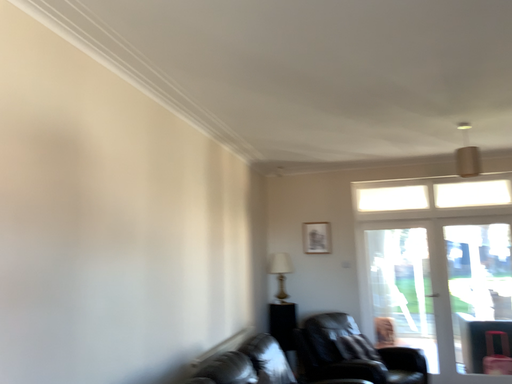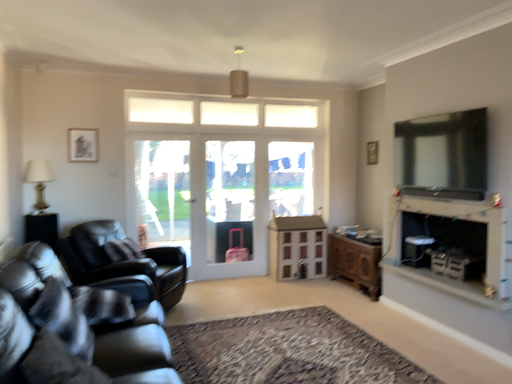
Question: How did the camera likely rotate when shooting the video?

Choices:
 (A) rotated left
 (B) rotated right

Answer: (B)